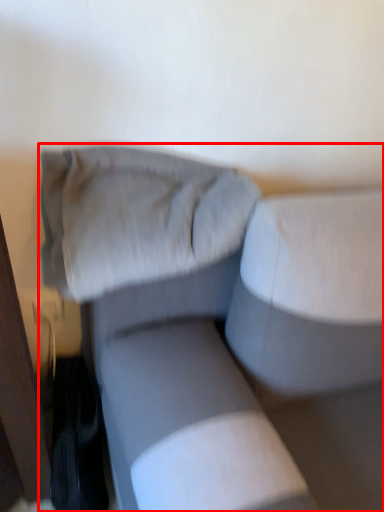
Question: From the image, what is the correct spatial relationship of studio couch (annotated by the red box) in relation to pillow?

Choices:
 (A) right
 (B) left

Answer: (A)